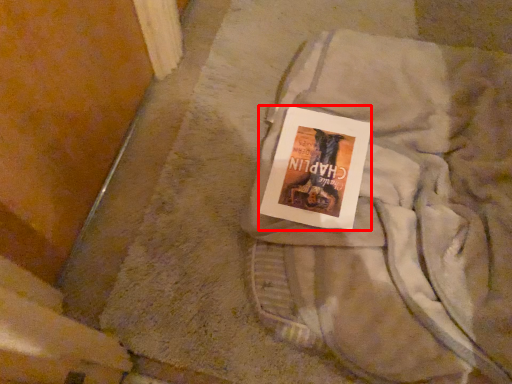
Question: Observing the image, what is the correct spatial positioning of paperback book (annotated by the red box) in reference to laundry?

Choices:
 (A) left
 (B) right

Answer: (A)